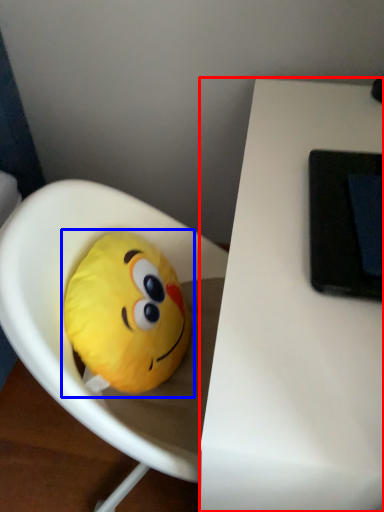
Question: Which point is closer to the camera, table (highlighted by a red box) or toy (highlighted by a blue box)?

Choices:
 (A) table
 (B) toy

Answer: (A)